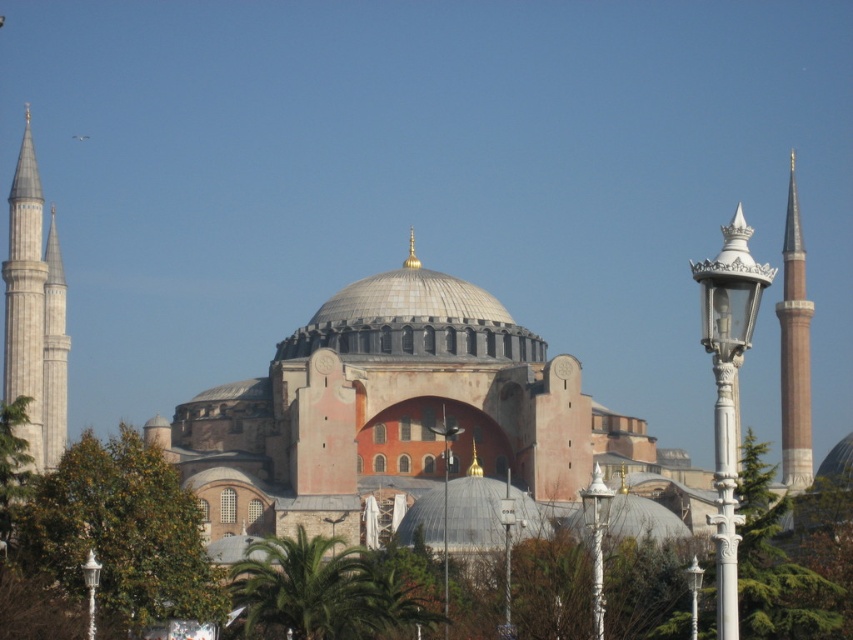
Question: Which point is farther to the camera?

Choices:
 (A) (10, 371)
 (B) (437, 355)
 (C) (216, 576)
 (D) (339, 636)

Answer: (B)

Question: Does golden mosaic dome at center appear on the right side of brown stone minaret at right?

Choices:
 (A) no
 (B) yes

Answer: (A)

Question: Is green leafy palm at center closer to camera compared to golden mosaic dome at center?

Choices:
 (A) no
 (B) yes

Answer: (B)

Question: Which point is closer to the camera?

Choices:
 (A) green leafy palm at center
 (B) golden mosaic dome at center
 (C) green leafy tree at lower left

Answer: (C)

Question: Observing the image, what is the correct spatial positioning of green leafy tree at lower left in reference to green leafy palm at center?

Choices:
 (A) right
 (B) left

Answer: (B)

Question: Which point is closer to the camera taking this photo?

Choices:
 (A) (399, 618)
 (B) (96, 468)
 (C) (48, 378)
 (D) (352, 291)

Answer: (B)